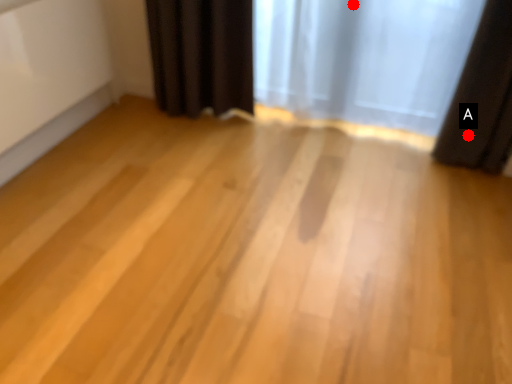
Question: Two points are circled on the image, labeled by A and B beside each circle. Which point appears farthest from the camera in this image?

Choices:
 (A) A is further
 (B) B is further

Answer: (B)